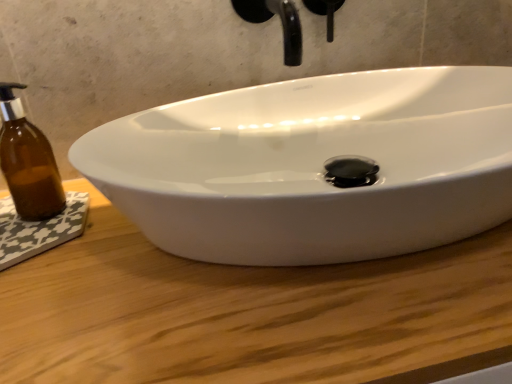
Locate an element on the screen. This screenshot has width=512, height=384. brown glass bottle at left is located at coordinates (28, 161).

Is point (332, 25) closer to viewer compared to point (29, 331)?

No, it is behind (29, 331).

From a real-world perspective, between black matte faucet at upper center and wooden at center, who is vertically lower?

In real-world perspective, wooden at center is lower.

Does black matte faucet at upper center have a lesser height compared to wooden at center?

Correct, black matte faucet at upper center is not as tall as wooden at center.

Can you confirm if wooden at center is bigger than black matte faucet at upper center?

Yes, wooden at center is bigger than black matte faucet at upper center.

At what (x,y) coordinates should I click in order to perform the action: click on counter top located underneath the black matte faucet at upper center (from a real-world perspective). Please return your answer as a coordinate pair (x, y). Looking at the image, I should click on (244, 312).

From a real-world perspective, is wooden at center under black matte faucet at upper center?

Yes, from a real-world perspective, wooden at center is under black matte faucet at upper center.

In the scene shown: Which is closer to the camera, (230,304) or (289,6)?

Positioned in front is point (230,304).

Does wooden at center lie behind brown glass bottle at left?

No, wooden at center is in front of brown glass bottle at left.

How far apart are wooden at center and brown glass bottle at left?

wooden at center is 27.04 centimeters from brown glass bottle at left.

From the image's perspective, is wooden at center located beneath brown glass bottle at left?

Correct, wooden at center appears lower than brown glass bottle at left in the image.

Considering the relative positions of wooden at center and brown glass bottle at left in the image provided, is wooden at center to the right of brown glass bottle at left from the viewer's perspective?

Correct, you'll find wooden at center to the right of brown glass bottle at left.

From the picture: Which is farther from the camera, (286, 35) or (16, 146)?

The point (286, 35) is farther from the camera.

Which object is wider, black matte faucet at upper center or brown glass bottle at left?

With larger width is black matte faucet at upper center.

Based on the photo, does black matte faucet at upper center touch brown glass bottle at left?

There is a gap between black matte faucet at upper center and brown glass bottle at left.

How much distance is there between black matte faucet at upper center and brown glass bottle at left?

black matte faucet at upper center is 13.37 inches away from brown glass bottle at left.

Which is closer to the camera, (24, 180) or (289, 51)?

Positioned in front is point (289, 51).

Between brown glass bottle at left and black matte faucet at upper center, which one has smaller width?

brown glass bottle at left is thinner.

Does brown glass bottle at left turn towards black matte faucet at upper center?

No.

Is the surface of brown glass bottle at left in direct contact with black matte faucet at upper center?

No, brown glass bottle at left is not in contact with black matte faucet at upper center.

Who is taller, brown glass bottle at left or wooden at center?

With more height is wooden at center.

Consider the image. Is brown glass bottle at left far from wooden at center?

brown glass bottle at left is near wooden at center, not far away.

From the image's perspective, would you say brown glass bottle at left is shown under wooden at center?

Actually, brown glass bottle at left appears above wooden at center in the image.

This screenshot has height=384, width=512. Find the location of `plumbing fixture above the wooden at center (from a real-world perspective)`. plumbing fixture above the wooden at center (from a real-world perspective) is located at coordinates (281, 22).

The width and height of the screenshot is (512, 384). Find the location of `plumbing fixture on the left of the wooden at center`. plumbing fixture on the left of the wooden at center is located at coordinates (281, 22).

Which object lies further to the anchor point wooden at center, black matte faucet at upper center or brown glass bottle at left?

black matte faucet at upper center.

Looking at the image, which one is located closer to brown glass bottle at left, wooden at center or black matte faucet at upper center?

The object closer to brown glass bottle at left is wooden at center.

Based on their spatial positions, is brown glass bottle at left or wooden at center closer to black matte faucet at upper center?

wooden at center lies closer to black matte faucet at upper center than the other object.

From the image, which object appears to be farther from black matte faucet at upper center, wooden at center or brown glass bottle at left?

The object further to black matte faucet at upper center is brown glass bottle at left.

When comparing their distances from brown glass bottle at left, does black matte faucet at upper center or wooden at center seem further?

black matte faucet at upper center lies further to brown glass bottle at left than the other object.

Estimate the real-world distances between objects in this image. Which object is closer to wooden at center, brown glass bottle at left or black matte faucet at upper center?

brown glass bottle at left is positioned closer to the anchor wooden at center.

At what (x,y) coordinates should I click in order to perform the action: click on bottle between black matte faucet at upper center and wooden at center in the up-down direction. Please return your answer as a coordinate pair (x, y). The height and width of the screenshot is (384, 512). Looking at the image, I should click on (28, 161).